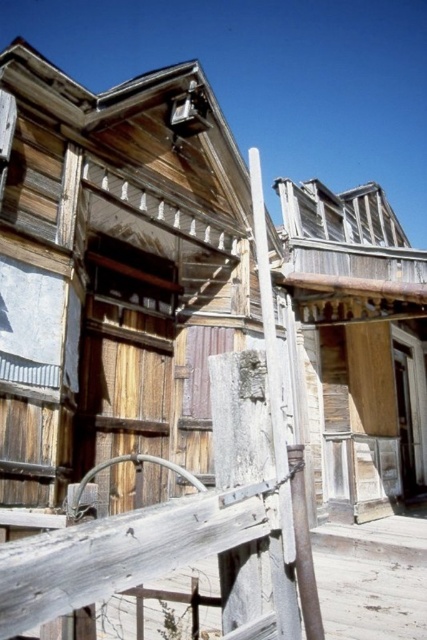
From the picture: Does weathered wood fence at center have a larger size compared to weathered wood hut at center?

Actually, weathered wood fence at center might be smaller than weathered wood hut at center.

Measure the distance between point (x=248, y=436) and camera.

The distance of point (x=248, y=436) from camera is 1.47 meters.

The width and height of the screenshot is (427, 640). What do you see at coordinates (187, 531) in the screenshot? I see `weathered wood fence at center` at bounding box center [187, 531].

Locate an element on the screen. The width and height of the screenshot is (427, 640). weathered wood fence at center is located at coordinates (187, 531).

Is weathered wood hut at center bigger than smooth gray pole at center?

No.

Can you confirm if weathered wood hut at center is taller than smooth gray pole at center?

Incorrect, weathered wood hut at center's height is not larger of smooth gray pole at center's.

The width and height of the screenshot is (427, 640). I want to click on weathered wood hut at center, so click(x=359, y=340).

Is weathered wood fence at center further to camera compared to smooth gray pole at center?

No.

From the picture: Is weathered wood fence at center to the left of smooth gray pole at center from the viewer's perspective?

Yes, weathered wood fence at center is to the left of smooth gray pole at center.

Between point (260, 381) and point (254, 189), which one is positioned in front?

Point (260, 381)

At what (x,y) coordinates should I click in order to perform the action: click on weathered wood fence at center. Please return your answer as a coordinate pair (x, y). Looking at the image, I should click on (x=187, y=531).